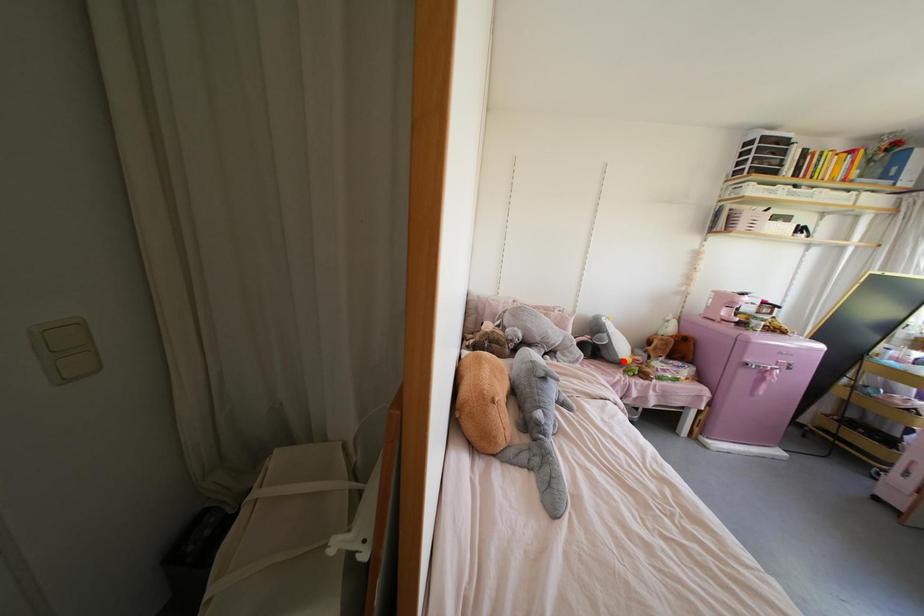
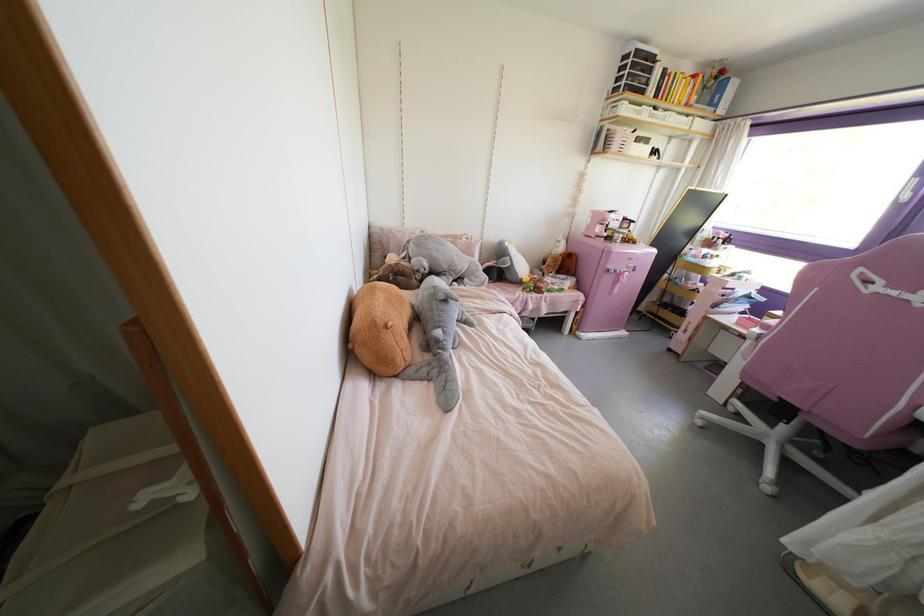
Question: I am providing you with two images of the same scene from different viewpoints. Given a red point in image1, look at the same physical point in image2. Is it:

Choices:
 (A) Closer to the viewpoint
 (B) Farther from the viewpoint

Answer: (A)